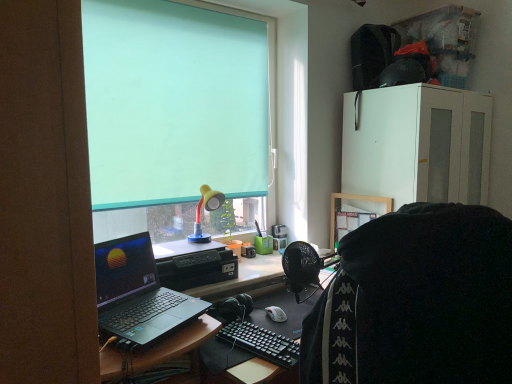
Question: Considering the relative sizes of silver metallic laptop at left and teal matte/soft roller blind at upper center in the image provided, is silver metallic laptop at left wider than teal matte/soft roller blind at upper center?

Choices:
 (A) no
 (B) yes

Answer: (B)

Question: Can you confirm if silver metallic laptop at left is positioned to the right of teal matte/soft roller blind at upper center?

Choices:
 (A) no
 (B) yes

Answer: (A)

Question: Is silver metallic laptop at left not near teal matte/soft roller blind at upper center?

Choices:
 (A) no
 (B) yes

Answer: (A)

Question: Is silver metallic laptop at left facing towards teal matte/soft roller blind at upper center?

Choices:
 (A) no
 (B) yes

Answer: (A)

Question: From a real-world perspective, does silver metallic laptop at left sit lower than teal matte/soft roller blind at upper center?

Choices:
 (A) no
 (B) yes

Answer: (B)

Question: Would you say silver metallic laptop at left is outside teal matte/soft roller blind at upper center?

Choices:
 (A) yes
 (B) no

Answer: (A)

Question: Considering the relative positions of teal matte/soft roller blind at upper center and white matte cabinet at upper right in the image provided, is teal matte/soft roller blind at upper center to the right of white matte cabinet at upper right from the viewer's perspective?

Choices:
 (A) no
 (B) yes

Answer: (A)

Question: Considering the relative sizes of teal matte/soft roller blind at upper center and white matte cabinet at upper right in the image provided, is teal matte/soft roller blind at upper center thinner than white matte cabinet at upper right?

Choices:
 (A) no
 (B) yes

Answer: (B)

Question: From the image's perspective, is teal matte/soft roller blind at upper center above white matte cabinet at upper right?

Choices:
 (A) no
 (B) yes

Answer: (B)

Question: Is the surface of teal matte/soft roller blind at upper center in direct contact with white matte cabinet at upper right?

Choices:
 (A) yes
 (B) no

Answer: (B)

Question: Is teal matte/soft roller blind at upper center completely or partially outside of white matte cabinet at upper right?

Choices:
 (A) no
 (B) yes

Answer: (B)

Question: Is teal matte/soft roller blind at upper center further to camera compared to white matte cabinet at upper right?

Choices:
 (A) yes
 (B) no

Answer: (B)

Question: Does teal matte/soft roller blind at upper center lie behind black fabric at center?

Choices:
 (A) yes
 (B) no

Answer: (A)